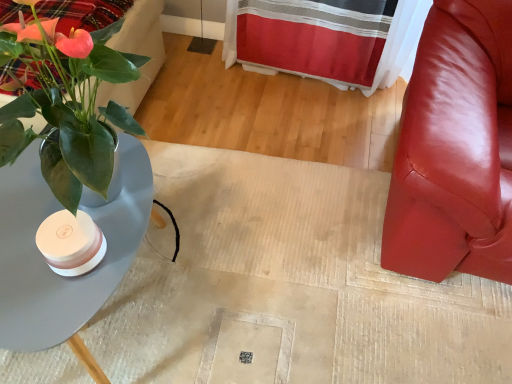
Identify the location of free space behind matte gray table at left. (193, 153).